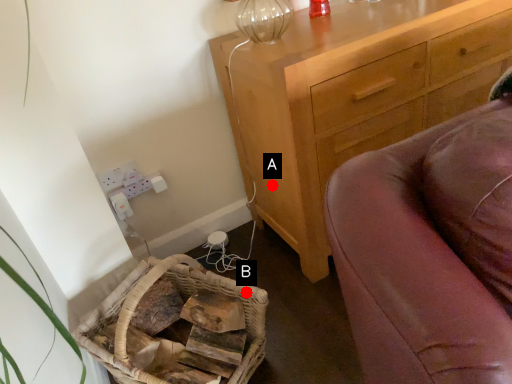
Question: Two points are circled on the image, labeled by A and B beside each circle. Among these points, which one is farthest from the camera?

Choices:
 (A) A is further
 (B) B is further

Answer: (A)